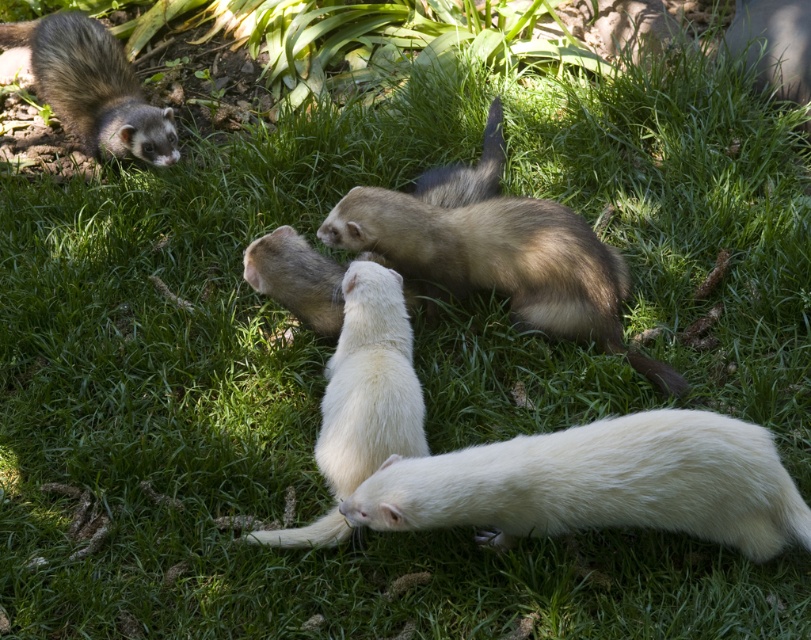
Question: Which of the following is the closest to the observer?

Choices:
 (A) white fur ferret at lower center
 (B) brown fur ferret at upper left

Answer: (A)

Question: Among these objects, which one is nearest to the camera?

Choices:
 (A) brown fur ferret at upper left
 (B) white fur ferret at lower center

Answer: (B)

Question: Can you confirm if white fur ferret at lower center is positioned to the left of brown fur ferret at upper left?

Choices:
 (A) no
 (B) yes

Answer: (A)

Question: Which point is closer to the camera?

Choices:
 (A) brown fur ferret at upper left
 (B) white fur ferret at lower center

Answer: (B)

Question: Can you confirm if white fur ferret at lower center is thinner than brown fur ferret at upper left?

Choices:
 (A) yes
 (B) no

Answer: (B)

Question: Is white fur ferret at lower center below brown fur ferret at upper left?

Choices:
 (A) yes
 (B) no

Answer: (A)